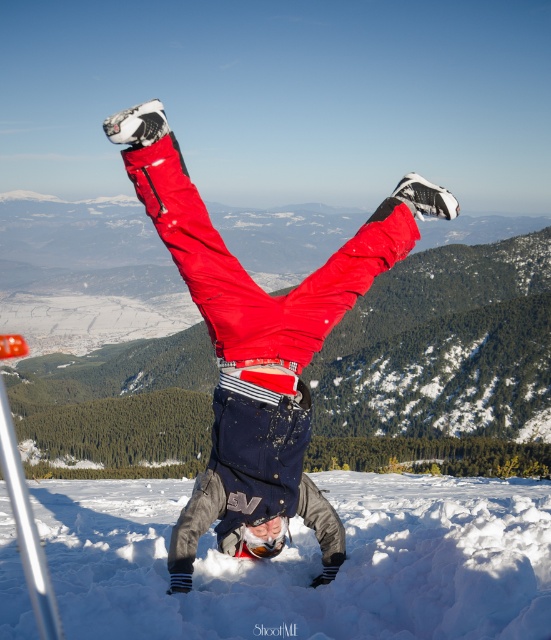
Question: Which of the following is the farthest from the observer?

Choices:
 (A) (164, 608)
 (B) (345, 262)

Answer: (B)

Question: Does white fluffy snow at center have a larger size compared to matte red pants at center?

Choices:
 (A) no
 (B) yes

Answer: (B)

Question: Is white fluffy snow at center wider than matte red pants at center?

Choices:
 (A) no
 (B) yes

Answer: (B)

Question: Does white fluffy snow at center have a smaller size compared to matte red pants at center?

Choices:
 (A) yes
 (B) no

Answer: (B)